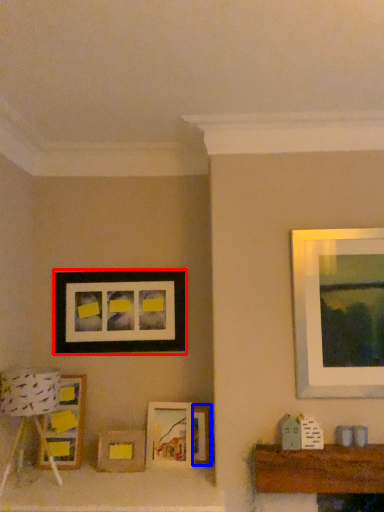
Question: Which point is closer to the camera, picture frame (highlighted by a red box) or picture frame (highlighted by a blue box)?

Choices:
 (A) picture frame
 (B) picture frame

Answer: (B)